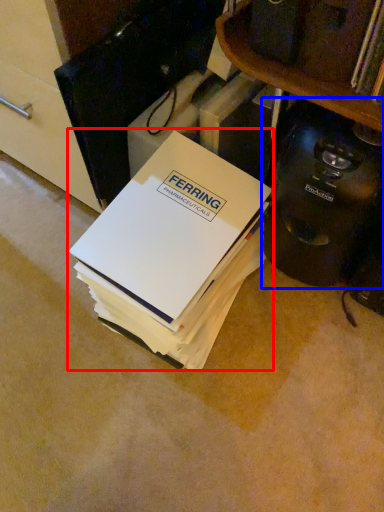
Question: Which of the following is the farthest to the observer, paperback book (highlighted by a red box) or home appliance (highlighted by a blue box)?

Choices:
 (A) paperback book
 (B) home appliance

Answer: (A)